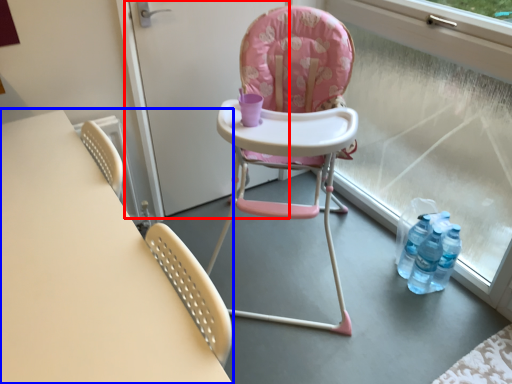
Question: Among these objects, which one is nearest to the camera, screen door (highlighted by a red box) or table (highlighted by a blue box)?

Choices:
 (A) screen door
 (B) table

Answer: (B)